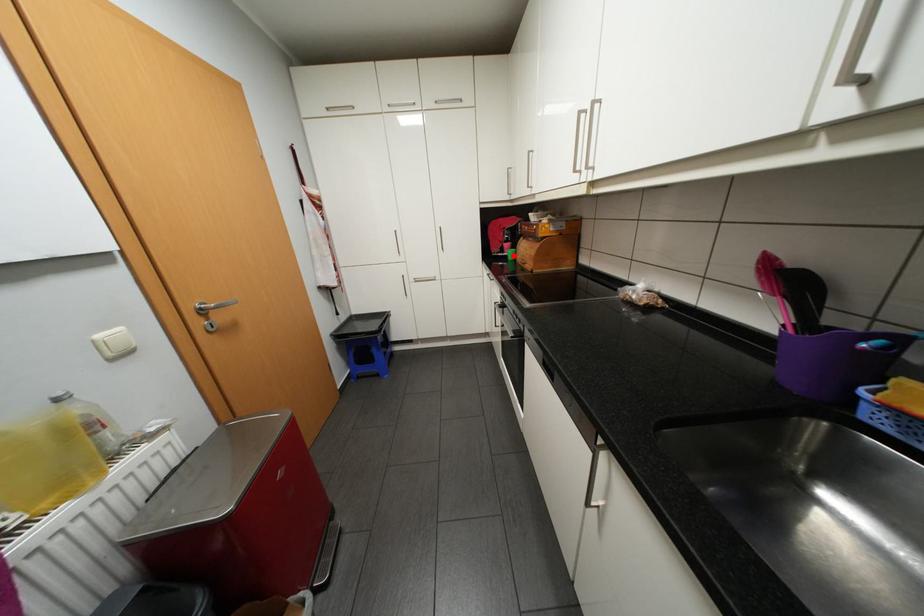
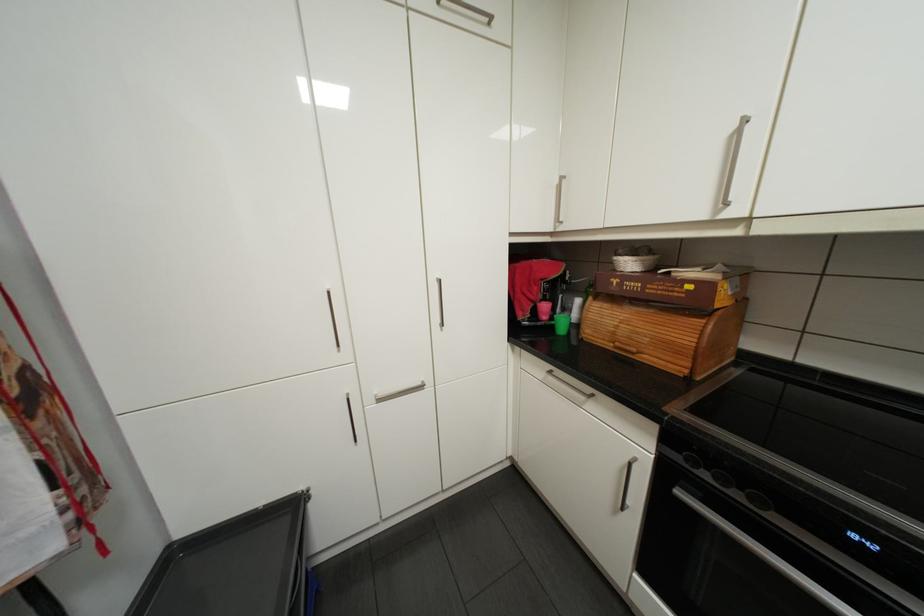
The point at the highlighted location is marked in the first image. Where is the corresponding point in the second image?

(557, 328)